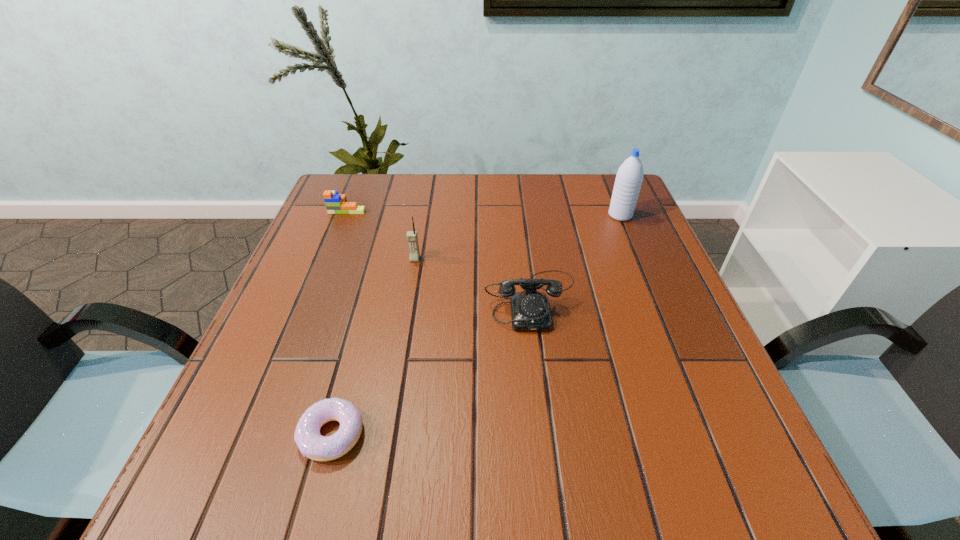
Where is `object that is the third closest to the fourth tallest object`? The image size is (960, 540). object that is the third closest to the fourth tallest object is located at coordinates (311, 443).

Identify the location of object that ranks as the third closest to the third tallest object. The image size is (960, 540). (311, 443).

Identify the location of free spot that satisfies the following two spatial constraints: 1. on the back side of the nearest object; 2. on the left side of the rightmost object. (391, 215).

Where is `free spot that satisfies the following two spatial constraints: 1. on the front side of the second shortest object; 2. on the right side of the second object from left to right`? The height and width of the screenshot is (540, 960). free spot that satisfies the following two spatial constraints: 1. on the front side of the second shortest object; 2. on the right side of the second object from left to right is located at coordinates (257, 434).